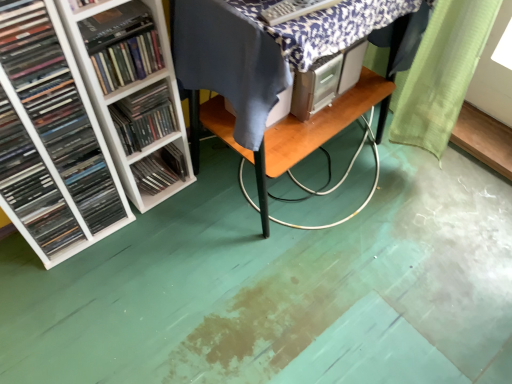
Identify the location of vacant region in front of matte black books at left, which ranks as the 3th book in right-to-left order. The height and width of the screenshot is (384, 512). 46,284.